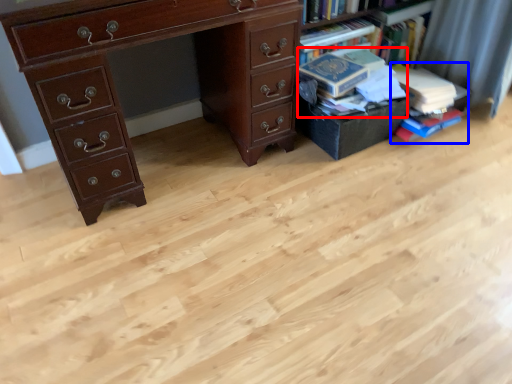
Question: Which object appears closest to the camera in this image, book (highlighted by a red box) or book (highlighted by a blue box)?

Choices:
 (A) book
 (B) book

Answer: (A)